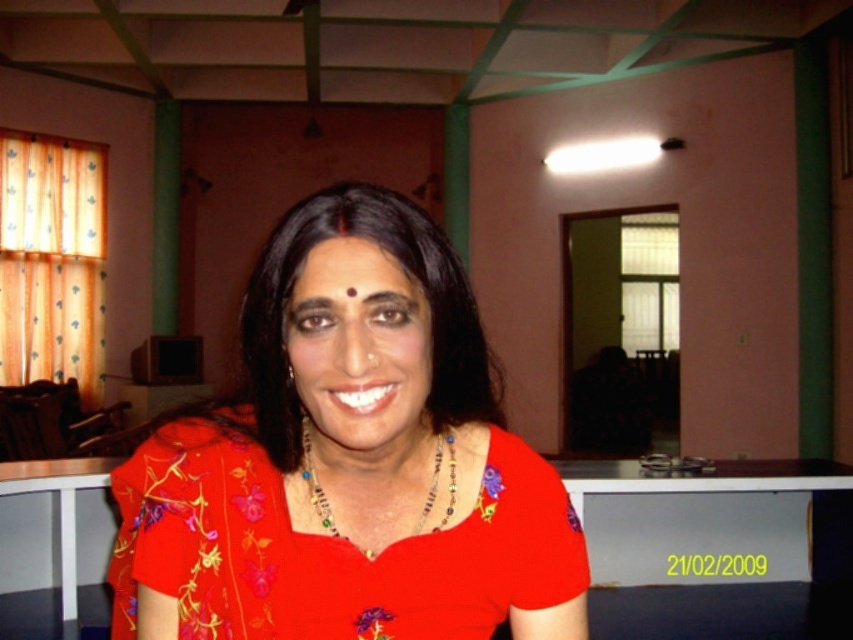
Question: Observing the image, what is the correct spatial positioning of matte red forehead at center in reference to beaded necklace at center?

Choices:
 (A) right
 (B) left

Answer: (B)

Question: Is matte red forehead at center smaller than beaded necklace at center?

Choices:
 (A) yes
 (B) no

Answer: (A)

Question: Estimate the real-world distances between objects in this image. Which object is farther from the matte red forehead at center?

Choices:
 (A) matte floral dress at center
 (B) beaded necklace at center

Answer: (B)

Question: Which is nearer to the matte red forehead at center?

Choices:
 (A) matte floral dress at center
 (B) beaded necklace at center

Answer: (A)

Question: Can you confirm if matte red forehead at center is positioned to the left of beaded necklace at center?

Choices:
 (A) yes
 (B) no

Answer: (A)

Question: Which is farther from the matte red forehead at center?

Choices:
 (A) matte floral dress at center
 (B) beaded necklace at center

Answer: (B)